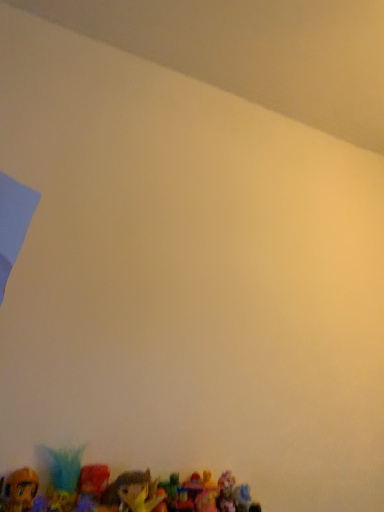
Question: Based on their sizes in the image, would you say plush toy at bottom, which is counted as the 2th toy, starting from the left, is bigger or smaller than shiny plastic toy at lower center, which is counted as the 3th toy, starting from the left?

Choices:
 (A) small
 (B) big

Answer: (B)

Question: Considering their positions, is plush toy at bottom, the second toy viewed from the right, located in front of or behind shiny plastic toy at lower center, which is counted as the 3th toy, starting from the left?

Choices:
 (A) front
 (B) behind

Answer: (B)

Question: Considering the real-world distances, which object is farthest from the shiny plastic toy at lower left, the 3th toy viewed from the right?

Choices:
 (A) shiny plastic toy at lower center, which is counted as the 3th toy, starting from the left
 (B) plush toy at bottom, the second toy viewed from the right

Answer: (A)

Question: Estimate the real-world distances between objects in this image. Which object is farther from the shiny plastic toy at lower center, marked as the first toy in a right-to-left arrangement?

Choices:
 (A) plush toy at bottom, the second toy viewed from the right
 (B) shiny plastic toy at lower left, the 1th toy positioned from the left

Answer: (B)